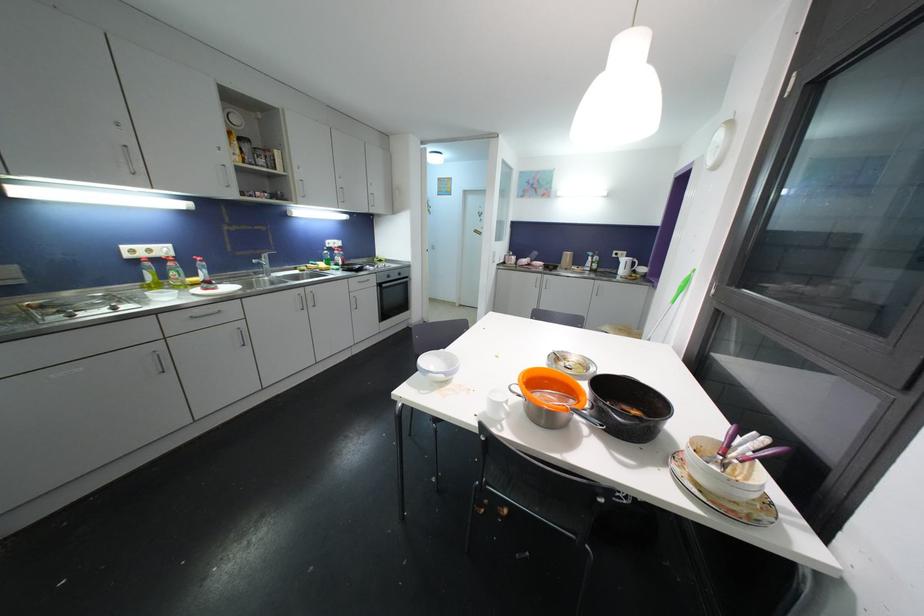
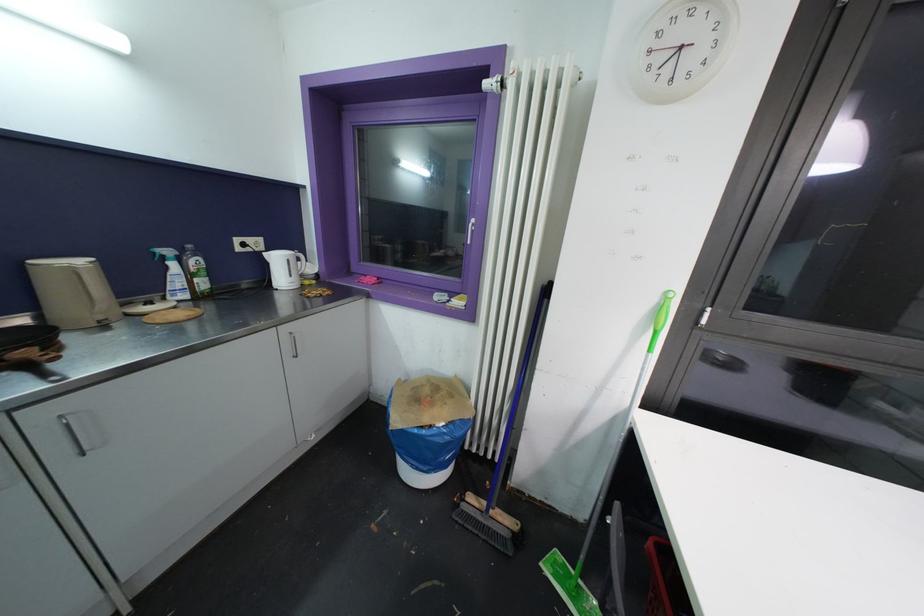
Where in the second image is the point corresponding to (627,264) from the first image?

(281, 262)